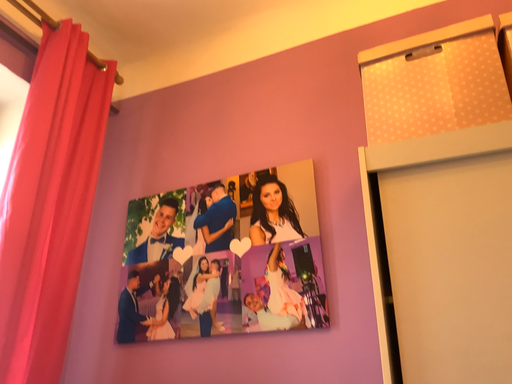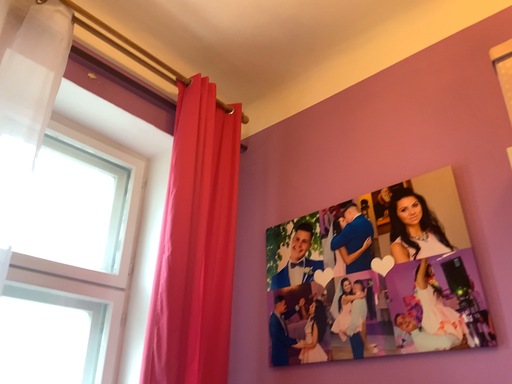
Question: Which way did the camera rotate in the video?

Choices:
 (A) rotated left
 (B) rotated right

Answer: (A)